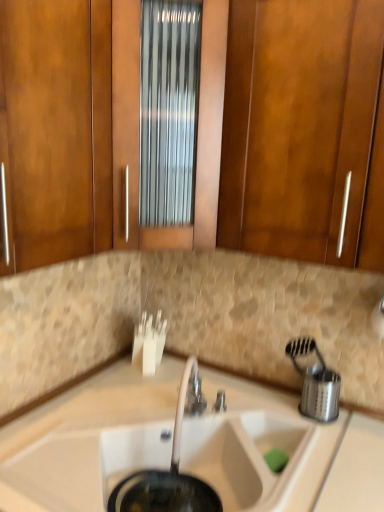
At what (x,y) coordinates should I click in order to perform the action: click on unoccupied area in front of stainless steel strainer at right. Please return your answer as a coordinate pair (x, y). The width and height of the screenshot is (384, 512). Looking at the image, I should click on (316, 438).